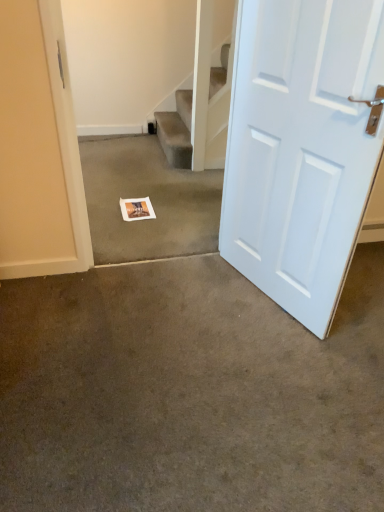
Image resolution: width=384 pixels, height=512 pixels. Describe the element at coordinates (136, 209) in the screenshot. I see `white paper postcard at center` at that location.

You are a GUI agent. You are given a task and a screenshot of the screen. Output one action in this format:
    pyautogui.click(x=<x>, y=<y>)
    Task: Click on the white matte door at right
    Image resolution: width=384 pixels, height=512 pixels.
    Given the screenshot: What is the action you would take?
    pyautogui.click(x=302, y=148)

Describe the element at coordinates (150, 199) in the screenshot. This screenshot has width=384, height=512. I see `white paper at center, the 1th concrete viewed from the top` at that location.

Where is `brown carpet at center, arranged as the second concrete when viewed from the back`? This screenshot has height=512, width=384. brown carpet at center, arranged as the second concrete when viewed from the back is located at coordinates pos(189,392).

From a real-world perspective, is white paper at center, which is counted as the 1th concrete, starting from the back, under brown carpet at center, marked as the first concrete in a bottom-to-top arrangement?

No, from a real-world perspective, white paper at center, which is counted as the 1th concrete, starting from the back, is not below brown carpet at center, marked as the first concrete in a bottom-to-top arrangement.

This screenshot has width=384, height=512. I want to click on concrete located in front of the white paper at center, which appears as the 2th concrete when viewed from the front, so click(x=189, y=392).

From their relative heights in the image, would you say white paper at center, which is counted as the 1th concrete, starting from the back, is taller or shorter than brown carpet at center, acting as the first concrete starting from the front?

In the image, white paper at center, which is counted as the 1th concrete, starting from the back, appears to be taller than brown carpet at center, acting as the first concrete starting from the front.

From a real-world perspective, is white paper postcard at center positioned over white matte door at right based on gravity?

Incorrect, from a real-world perspective, white paper postcard at center is lower than white matte door at right.

Measure the distance from white paper postcard at center to white matte door at right.

white paper postcard at center is 3.67 feet from white matte door at right.

Is white paper postcard at center looking in the opposite direction of white matte door at right?

That's not correct — white paper postcard at center is not looking away from white matte door at right.

Locate an element on the screen. This screenshot has width=384, height=512. door in front of the white paper postcard at center is located at coordinates (302, 148).

Which object is positioned more to the right, white matte door at right or white paper postcard at center?

white matte door at right.

Is white matte door at right spatially inside white paper postcard at center, or outside of it?

white matte door at right is located beyond the bounds of white paper postcard at center.

Is white matte door at right with white paper postcard at center?

No, white matte door at right is not in contact with white paper postcard at center.

From the picture: From the image's perspective, between white matte door at right and white paper postcard at center, who is located below?

white paper postcard at center appears lower in the image.

Choose the correct answer: Is white matte door at right inside white paper at center, the 1th concrete viewed from the top, or outside it?

white matte door at right is outside white paper at center, the 1th concrete viewed from the top.

Which concrete is the 2nd one when counting from the left side of the white matte door at right? Please provide its 2D coordinates.

[(150, 199)]

Could you tell me if white matte door at right is facing white paper at center, which appears as the 2th concrete when viewed from the front?

No, white matte door at right does not turn towards white paper at center, which appears as the 2th concrete when viewed from the front.

Is white matte door at right behind white paper at center, which is counted as the 1th concrete, starting from the back?

No, it is not.

Who is bigger, brown carpet at center, marked as the first concrete in a bottom-to-top arrangement, or white matte door at right?

Bigger between the two is brown carpet at center, marked as the first concrete in a bottom-to-top arrangement.

Which object is thinner, brown carpet at center, acting as the first concrete starting from the front, or white matte door at right?

white matte door at right.

From the image's perspective, which one is positioned lower, brown carpet at center, arranged as the second concrete when viewed from the back, or white matte door at right?

From the image's view, brown carpet at center, arranged as the second concrete when viewed from the back, is below.

From a real-world perspective, who is located higher, brown carpet at center, arranged as the 2th concrete when viewed from the top, or white matte door at right?

white matte door at right is physically above.

Based on the photo, from a real-world perspective, is white paper postcard at center under white paper at center, which appears as the 2th concrete when viewed from the front?

Indeed, from a real-world perspective, white paper postcard at center is positioned beneath white paper at center, which appears as the 2th concrete when viewed from the front.

From the image's perspective, who appears lower, white paper postcard at center or white paper at center, which appears as the 2th concrete when viewed from the front?

white paper postcard at center is shown below in the image.

Which object is wider, white paper postcard at center or white paper at center, which appears as the 2th concrete when viewed from the front?

With larger width is white paper at center, which appears as the 2th concrete when viewed from the front.

Does point (124, 211) lie behind point (94, 145)?

No, it is in front of (94, 145).

Is white paper at center, the 1th concrete viewed from the top, oriented away from white matte door at right?

That's not correct — white paper at center, the 1th concrete viewed from the top, is not looking away from white matte door at right.

Does white paper at center, the 1th concrete viewed from the top, have a smaller size compared to white matte door at right?

No, white paper at center, the 1th concrete viewed from the top, is not smaller than white matte door at right.

The image size is (384, 512). Find the location of `concrete that is the 1st one below the white matte door at right (from a real-world perspective)`. concrete that is the 1st one below the white matte door at right (from a real-world perspective) is located at coordinates (150, 199).

Locate an element on the screen. The width and height of the screenshot is (384, 512). concrete that appears above the brown carpet at center, arranged as the second concrete when viewed from the back (from a real-world perspective) is located at coordinates (150, 199).

In the image, there is a white matte door at right. Where is `postcard below it (from a real-world perspective)`? The width and height of the screenshot is (384, 512). postcard below it (from a real-world perspective) is located at coordinates 136,209.

Based on their spatial positions, is brown carpet at center, arranged as the second concrete when viewed from the back, or white paper at center, the 1th concrete viewed from the top, further from white matte door at right?

The object further to white matte door at right is white paper at center, the 1th concrete viewed from the top.

When comparing their distances from white paper postcard at center, does brown carpet at center, marked as the first concrete in a bottom-to-top arrangement, or white paper at center, which is counted as the 1th concrete, starting from the back, seem closer?

white paper at center, which is counted as the 1th concrete, starting from the back, is closer to white paper postcard at center.

Which object lies further to the anchor point white paper postcard at center, brown carpet at center, marked as the first concrete in a bottom-to-top arrangement, or white matte door at right?

brown carpet at center, marked as the first concrete in a bottom-to-top arrangement, lies further to white paper postcard at center than the other object.

Based on their spatial positions, is white paper at center, which appears as the 2th concrete when viewed from the front, or white matte door at right closer to white paper postcard at center?

white paper at center, which appears as the 2th concrete when viewed from the front, is positioned closer to the anchor white paper postcard at center.

Estimate the real-world distances between objects in this image. Which object is further from white matte door at right, brown carpet at center, acting as the first concrete starting from the front, or white paper postcard at center?

white paper postcard at center is further to white matte door at right.

When comparing their distances from brown carpet at center, acting as the first concrete starting from the front, does white matte door at right or white paper postcard at center seem closer?

white matte door at right is closer to brown carpet at center, acting as the first concrete starting from the front.

Based on their spatial positions, is white matte door at right or white paper postcard at center closer to white paper at center, which appears as the 2th concrete when viewed from the front?

The object closer to white paper at center, which appears as the 2th concrete when viewed from the front, is white paper postcard at center.

Considering their positions, is brown carpet at center, arranged as the second concrete when viewed from the back, positioned closer to white paper at center, which is counted as the 1th concrete, starting from the back, than white matte door at right?

white matte door at right is closer to white paper at center, which is counted as the 1th concrete, starting from the back.

The width and height of the screenshot is (384, 512). Find the location of `concrete between brown carpet at center, arranged as the 2th concrete when viewed from the top, and white paper postcard at center, along the z-axis`. concrete between brown carpet at center, arranged as the 2th concrete when viewed from the top, and white paper postcard at center, along the z-axis is located at coordinates (150, 199).

Locate an element on the screen. The width and height of the screenshot is (384, 512). concrete positioned between white matte door at right and white paper postcard at center from near to far is located at coordinates (150, 199).

You are a GUI agent. You are given a task and a screenshot of the screen. Output one action in this format:
    pyautogui.click(x=<x>, y=<y>)
    Task: Click on the door between brown carpet at center, arranged as the second concrete when viewed from the back, and white paper postcard at center from front to back
    The height and width of the screenshot is (512, 384).
    Given the screenshot: What is the action you would take?
    click(302, 148)

Where is `door between brown carpet at center, arranged as the 2th concrete when viewed from the top, and white paper at center, the 1th concrete viewed from the top, along the z-axis`? This screenshot has width=384, height=512. door between brown carpet at center, arranged as the 2th concrete when viewed from the top, and white paper at center, the 1th concrete viewed from the top, along the z-axis is located at coordinates (302, 148).